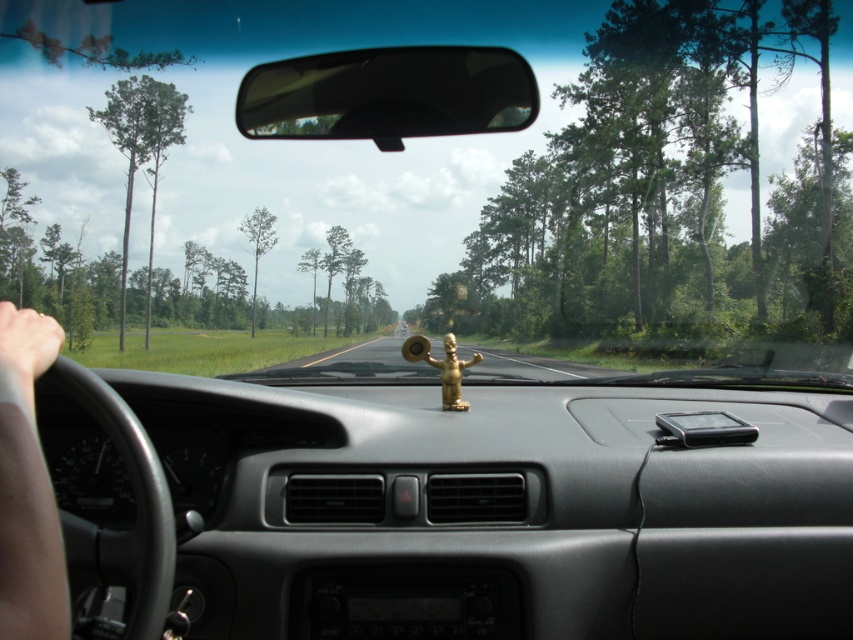
Does skinny tan arm at lower left appear on the left side of skinny flesh-toned hand at left?

Yes, skinny tan arm at lower left is to the left of skinny flesh-toned hand at left.

Is skinny tan arm at lower left behind skinny flesh-toned hand at left?

That is False.

Who is more forward, (44, 630) or (38, 316)?

Point (44, 630)

This screenshot has height=640, width=853. I want to click on skinny tan arm at lower left, so click(x=27, y=484).

Between skinny tan arm at lower left and black leather steering wheel at left, which one has less height?

skinny tan arm at lower left is shorter.

Between skinny tan arm at lower left and black leather steering wheel at left, which one appears on the left side from the viewer's perspective?

skinny tan arm at lower left is more to the left.

The image size is (853, 640). Identify the location of skinny tan arm at lower left. [27, 484].

Between black leather steering wheel at left and skinny flesh-toned hand at left, which one has more height?

With more height is black leather steering wheel at left.

Between black leather steering wheel at left and skinny flesh-toned hand at left, which one is positioned higher?

skinny flesh-toned hand at left is above.

This screenshot has width=853, height=640. In order to click on black leather steering wheel at left in this screenshot , I will do `click(135, 509)`.